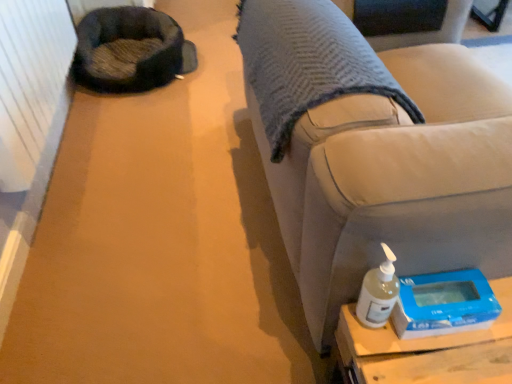
Question: From the image's perspective, is blue plastic scale at lower right located above or below satin beige couch at lower right?

Choices:
 (A) above
 (B) below

Answer: (B)

Question: Would you say blue plastic scale at lower right is to the left or to the right of satin beige couch at lower right in the picture?

Choices:
 (A) right
 (B) left

Answer: (B)

Question: Which is nearer to the dark gray plush bean bag chair at upper left?

Choices:
 (A) satin beige couch at lower right
 (B) blue plastic scale at lower right
 (C) white matte bottle at lower right

Answer: (A)

Question: Which is farther from the dark gray plush bean bag chair at upper left?

Choices:
 (A) white matte bottle at lower right
 (B) blue plastic scale at lower right
 (C) satin beige couch at lower right

Answer: (B)